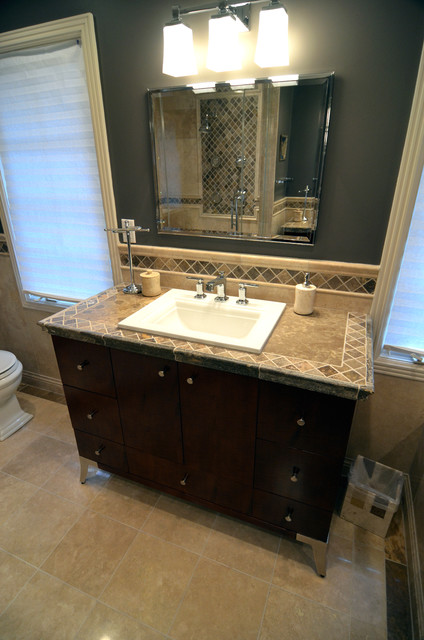
The image size is (424, 640). What are the coordinates of `sink` in the screenshot? It's located at pyautogui.click(x=212, y=324).